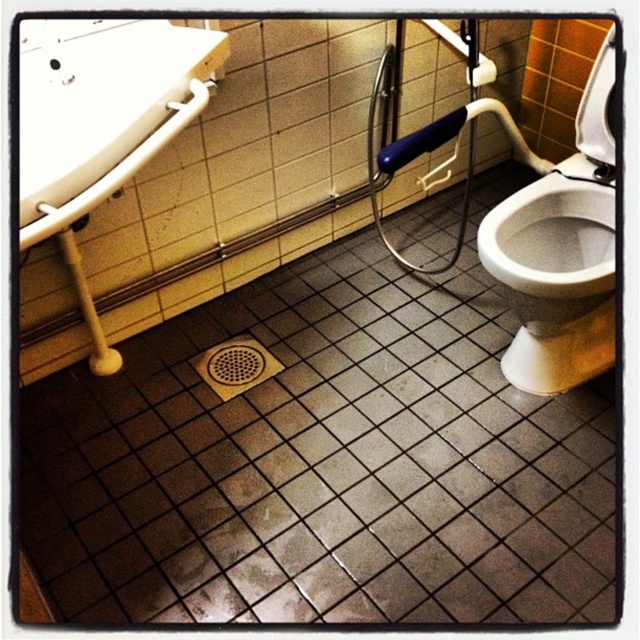
Between white glossy sink at upper left and brown textured drain at center, which one has less height?

With less height is brown textured drain at center.

Who is taller, white glossy sink at upper left or brown textured drain at center?

white glossy sink at upper left

Between point (92, 134) and point (236, 376), which one is positioned in front?

Point (92, 134)

The height and width of the screenshot is (640, 640). In order to click on white glossy sink at upper left in this screenshot , I will do `click(104, 113)`.

Is point (579, 246) in front of point (230, 355)?

Yes, point (579, 246) is in front of point (230, 355).

Does white glossy toilet bowl at right have a smaller size compared to brown textured drain at center?

No.

Who is more distant from viewer, (532, 291) or (220, 368)?

Positioned behind is point (220, 368).

Locate an element on the screen. The image size is (640, 640). white glossy toilet bowl at right is located at coordinates (556, 280).

Which is behind, point (124, 51) or point (568, 193)?

Positioned behind is point (568, 193).

Describe the element at coordinates (104, 113) in the screenshot. This screenshot has width=640, height=640. I see `white glossy sink at upper left` at that location.

Locate an element on the screen. white glossy sink at upper left is located at coordinates (104, 113).